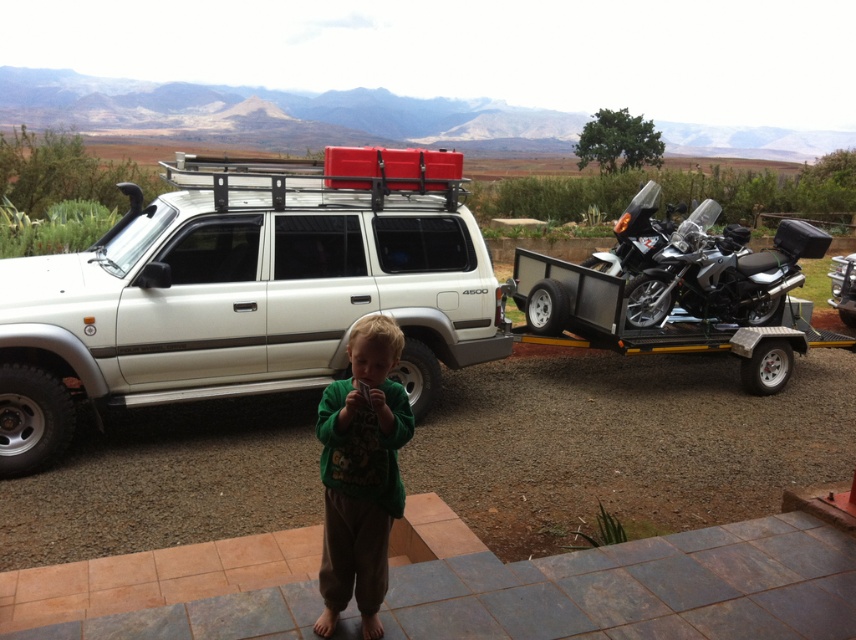
You are a photographer setting up a shot of the green fuzzy sweater at center and the black textured motorcycle at right. If you want to frame both subjects so that the sweater is on the left side of the motorcycle, is your current setup correct?

Yes, the current setup is correct because the green fuzzy sweater at center is already positioned to the left of the black textured motorcycle at right.